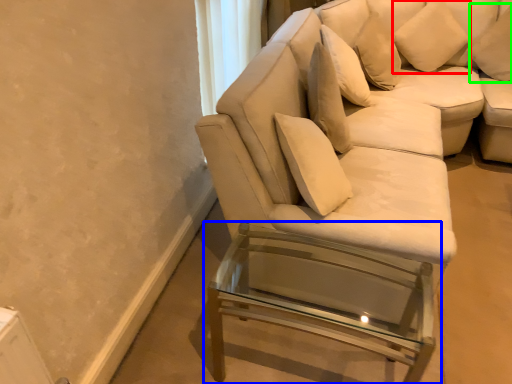
Question: Which object is positioned closest to pillow (highlighted by a red box)? Select from table (highlighted by a blue box) and pillow (highlighted by a green box).

Choices:
 (A) table
 (B) pillow

Answer: (B)